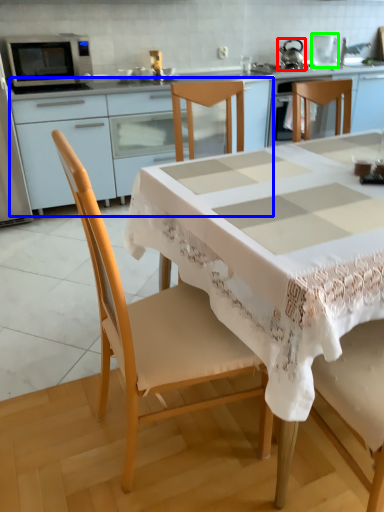
Question: Which is farther away from tea pot (highlighted by a red box)? cabinetry (highlighted by a blue box) or appliance (highlighted by a green box)?

Choices:
 (A) cabinetry
 (B) appliance

Answer: (A)